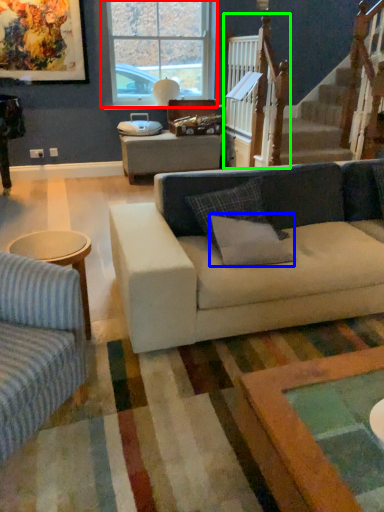
Question: Based on their relative distances, which object is nearer to window (highlighted by a red box)? Choose from pillow (highlighted by a blue box) and rail (highlighted by a green box).

Choices:
 (A) pillow
 (B) rail

Answer: (B)